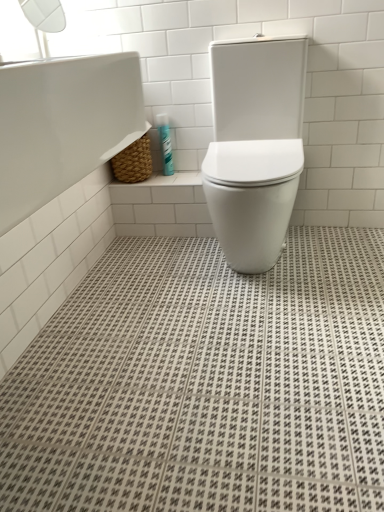
This screenshot has width=384, height=512. What do you see at coordinates (57, 179) in the screenshot?
I see `white glossy bathtub at upper left` at bounding box center [57, 179].

What do you see at coordinates (255, 146) in the screenshot? I see `white glossy toilet at center` at bounding box center [255, 146].

The height and width of the screenshot is (512, 384). In order to click on transparent plastic window screen at upper left in this screenshot , I will do point(49,36).

I want to click on white glossy bathtub at upper left, so click(x=57, y=179).

Based on the photo, can you confirm if teal plastic toothpaste tube at upper center is smaller than white glossy bathtub at upper left?

Yes, teal plastic toothpaste tube at upper center is smaller than white glossy bathtub at upper left.

Is teal plastic toothpaste tube at upper center directly adjacent to white glossy bathtub at upper left?

They are not placed beside each other.

Is teal plastic toothpaste tube at upper center oriented towards white glossy bathtub at upper left?

→ Yes, teal plastic toothpaste tube at upper center is facing white glossy bathtub at upper left.

From a real-world perspective, is teal plastic toothpaste tube at upper center physically located above or below white glossy bathtub at upper left?

Clearly, from a real-world perspective, teal plastic toothpaste tube at upper center is below white glossy bathtub at upper left.

Considering the relative sizes of teal plastic toothpaste tube at upper center and transparent plastic window screen at upper left in the image provided, is teal plastic toothpaste tube at upper center smaller than transparent plastic window screen at upper left?

Indeed, teal plastic toothpaste tube at upper center has a smaller size compared to transparent plastic window screen at upper left.

Consider the image. Is teal plastic toothpaste tube at upper center at the right side of transparent plastic window screen at upper left?

Indeed, teal plastic toothpaste tube at upper center is positioned on the right side of transparent plastic window screen at upper left.

From the image's perspective, relative to transparent plastic window screen at upper left, is teal plastic toothpaste tube at upper center above or below?

teal plastic toothpaste tube at upper center is below transparent plastic window screen at upper left.

Could you tell me if teal plastic toothpaste tube at upper center is turned towards transparent plastic window screen at upper left?

No, teal plastic toothpaste tube at upper center is not aimed at transparent plastic window screen at upper left.

How different are the orientations of white glossy toilet at center and white glossy bathtub at upper left in degrees?

There is a 91.8-degree angle between the facing directions of white glossy toilet at center and white glossy bathtub at upper left.

Which is more to the left, white glossy toilet at center or white glossy bathtub at upper left?

white glossy bathtub at upper left is more to the left.

Considering the relative sizes of white glossy toilet at center and white glossy bathtub at upper left in the image provided, is white glossy toilet at center shorter than white glossy bathtub at upper left?

No.

You are a GUI agent. You are given a task and a screenshot of the screen. Output one action in this format:
    pyautogui.click(x=<x>, y=<y>)
    Task: Click on the bath below the white glossy toilet at center (from the image's perspective)
    
    Given the screenshot: What is the action you would take?
    pyautogui.click(x=57, y=179)

Is transparent plastic window screen at upper left turned away from teal plastic toothpaste tube at upper center?

No, transparent plastic window screen at upper left is not facing the opposite direction of teal plastic toothpaste tube at upper center.

Measure the distance between transparent plastic window screen at upper left and teal plastic toothpaste tube at upper center.

transparent plastic window screen at upper left is 21.55 inches from teal plastic toothpaste tube at upper center.

Relative to teal plastic toothpaste tube at upper center, is transparent plastic window screen at upper left in front or behind?

transparent plastic window screen at upper left is positioned closer to the viewer than teal plastic toothpaste tube at upper center.

From the image's perspective, is transparent plastic window screen at upper left under teal plastic toothpaste tube at upper center?

Incorrect, from the image's perspective, transparent plastic window screen at upper left is higher than teal plastic toothpaste tube at upper center.

Could you tell me if white glossy bathtub at upper left is facing teal plastic toothpaste tube at upper center?

No, white glossy bathtub at upper left does not turn towards teal plastic toothpaste tube at upper center.

Which is behind, point (2, 202) or point (163, 150)?

Positioned behind is point (163, 150).

In the scene shown: Is white glossy bathtub at upper left bigger than teal plastic toothpaste tube at upper center?

Correct, white glossy bathtub at upper left is larger in size than teal plastic toothpaste tube at upper center.

Consider the image. Between white glossy bathtub at upper left and teal plastic toothpaste tube at upper center, which one is positioned behind?

teal plastic toothpaste tube at upper center is further away from the camera.

At what (x,y) coordinates should I click in order to perform the action: click on toilet that is in front of the teal plastic toothpaste tube at upper center. Please return your answer as a coordinate pair (x, y). This screenshot has height=512, width=384. Looking at the image, I should click on (255, 146).

Considering the sizes of teal plastic toothpaste tube at upper center and white glossy toilet at center in the image, is teal plastic toothpaste tube at upper center wider or thinner than white glossy toilet at center?

Considering their sizes, teal plastic toothpaste tube at upper center looks slimmer than white glossy toilet at center.

From the picture: Is teal plastic toothpaste tube at upper center turned away from white glossy toilet at center?

No.

From a real-world perspective, relative to white glossy toilet at center, is teal plastic toothpaste tube at upper center vertically above or below?

teal plastic toothpaste tube at upper center is below white glossy toilet at center.

From the image's perspective, who appears lower, white glossy toilet at center or teal plastic toothpaste tube at upper center?

white glossy toilet at center appears lower in the image.

Is white glossy toilet at center placed right next to teal plastic toothpaste tube at upper center?

They are not placed beside each other.

From a real-world perspective, which is physically above, white glossy toilet at center or teal plastic toothpaste tube at upper center?

From a 3D spatial view, white glossy toilet at center is above.

Consider the image. Between white glossy toilet at center and teal plastic toothpaste tube at upper center, which one appears on the left side from the viewer's perspective?

teal plastic toothpaste tube at upper center.

Find the location of a particular element. toiletry lying on the right of white glossy bathtub at upper left is located at coordinates (165, 143).

You are a GUI agent. You are given a task and a screenshot of the screen. Output one action in this format:
    pyautogui.click(x=<x>, y=<y>)
    Task: Click on the window screen lying on the left of teal plastic toothpaste tube at upper center
    
    Given the screenshot: What is the action you would take?
    pyautogui.click(x=49, y=36)

In the scene shown: Which object lies further to the anchor point teal plastic toothpaste tube at upper center, transparent plastic window screen at upper left or white glossy toilet at center?

Among the two, transparent plastic window screen at upper left is located further to teal plastic toothpaste tube at upper center.

Estimate the real-world distances between objects in this image. Which object is further from transparent plastic window screen at upper left, white glossy toilet at center or teal plastic toothpaste tube at upper center?

white glossy toilet at center lies further to transparent plastic window screen at upper left than the other object.

Looking at the image, which one is located closer to teal plastic toothpaste tube at upper center, white glossy toilet at center or white glossy bathtub at upper left?

The object closer to teal plastic toothpaste tube at upper center is white glossy bathtub at upper left.

From the image, which object appears to be nearer to white glossy bathtub at upper left, teal plastic toothpaste tube at upper center or white glossy toilet at center?

teal plastic toothpaste tube at upper center lies closer to white glossy bathtub at upper left than the other object.

Considering their positions, is transparent plastic window screen at upper left positioned further to white glossy bathtub at upper left than white glossy toilet at center?

Based on the image, white glossy toilet at center appears to be further to white glossy bathtub at upper left.

From the image, which object appears to be farther from white glossy bathtub at upper left, teal plastic toothpaste tube at upper center or transparent plastic window screen at upper left?

transparent plastic window screen at upper left lies further to white glossy bathtub at upper left than the other object.

Considering their positions, is teal plastic toothpaste tube at upper center positioned closer to white glossy toilet at center than transparent plastic window screen at upper left?

teal plastic toothpaste tube at upper center.

Which object lies further to the anchor point transparent plastic window screen at upper left, white glossy toilet at center or white glossy bathtub at upper left?

Based on the image, white glossy toilet at center appears to be further to transparent plastic window screen at upper left.

Identify the location of toilet between white glossy bathtub at upper left and teal plastic toothpaste tube at upper center from front to back. The width and height of the screenshot is (384, 512). (255, 146).

Where is `toilet between white glossy bathtub at upper left and transparent plastic window screen at upper left from front to back`? toilet between white glossy bathtub at upper left and transparent plastic window screen at upper left from front to back is located at coordinates (255, 146).

Where is `window screen between white glossy bathtub at upper left and teal plastic toothpaste tube at upper center from front to back`? window screen between white glossy bathtub at upper left and teal plastic toothpaste tube at upper center from front to back is located at coordinates (49, 36).

The width and height of the screenshot is (384, 512). I want to click on window screen between white glossy toilet at center and teal plastic toothpaste tube at upper center from front to back, so click(49, 36).